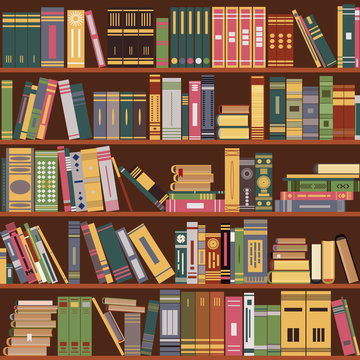
The width and height of the screenshot is (360, 360). Find the location of `books leaning to the right`. books leaning to the right is located at coordinates (26, 91), (31, 100), (36, 111), (43, 124), (150, 331).